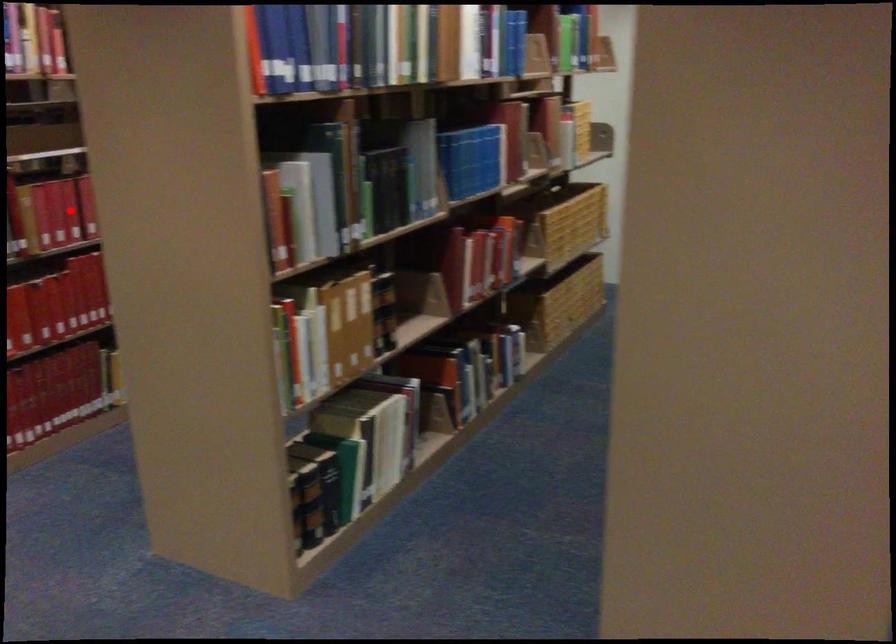
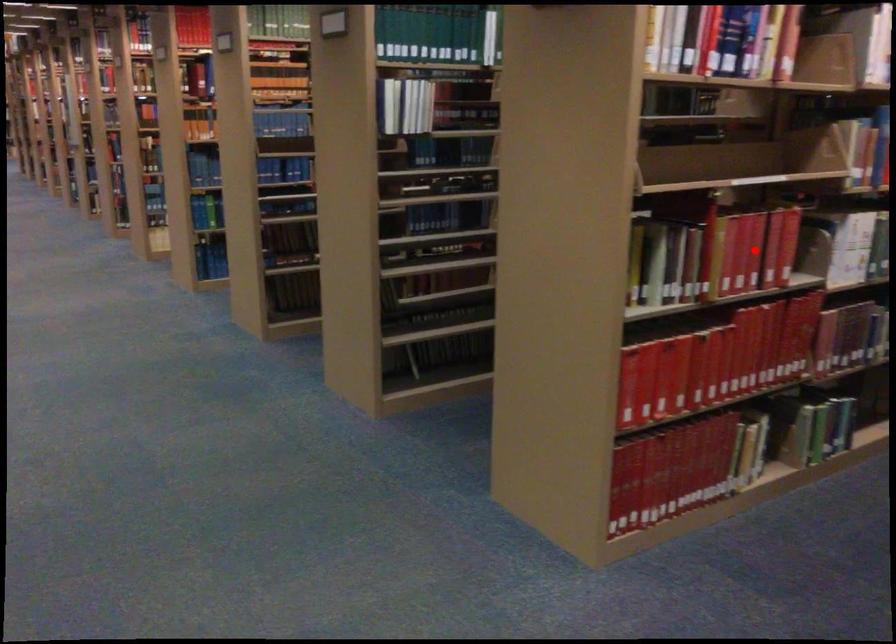
I am providing you with two images of the same scene from different viewpoints. A red point is marked on the first image and another point is marked on the second image. Is the marked point in image1 the same physical position as the marked point in image2?

Yes